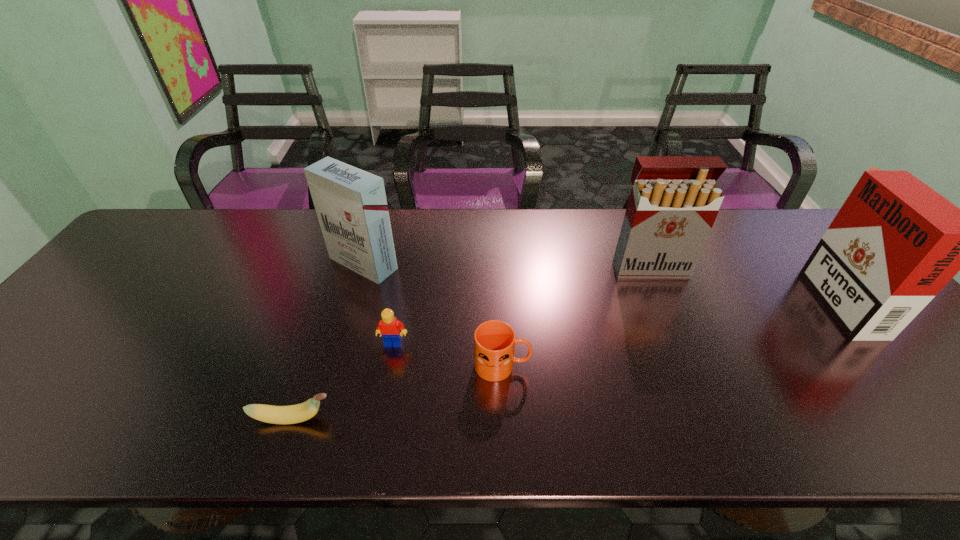
Where is `vacant space located 0.290m on the front-facing side of the rightmost cigarette case`? This screenshot has width=960, height=540. vacant space located 0.290m on the front-facing side of the rightmost cigarette case is located at coordinates (708, 296).

Where is `vacant space located 0.350m on the front-facing side of the rightmost cigarette case`? vacant space located 0.350m on the front-facing side of the rightmost cigarette case is located at coordinates (686, 296).

This screenshot has width=960, height=540. I want to click on free space located on the right of the leftmost cigarette case, so click(x=523, y=264).

Locate an element on the screen. The width and height of the screenshot is (960, 540). free location located 0.250m on the face of the Lego is located at coordinates (374, 449).

Find the location of a particular element. Image resolution: width=960 pixels, height=540 pixels. vacant space situated on the handle side of the fourth object from left to right is located at coordinates (561, 366).

Locate an element on the screen. The image size is (960, 540). free space located 0.170m at the stem of the shortest object is located at coordinates click(x=418, y=419).

The image size is (960, 540). What are the coordinates of `object that is at the far edge` in the screenshot? It's located at (351, 205).

At what (x,y) coordinates should I click in order to perform the action: click on object present at the near edge. Please return your answer as a coordinate pair (x, y). Looking at the image, I should click on [x=291, y=414].

Where is `object at the right edge`? The width and height of the screenshot is (960, 540). object at the right edge is located at coordinates (895, 243).

Locate an element on the screen. vacant area at the far edge is located at coordinates (231, 229).